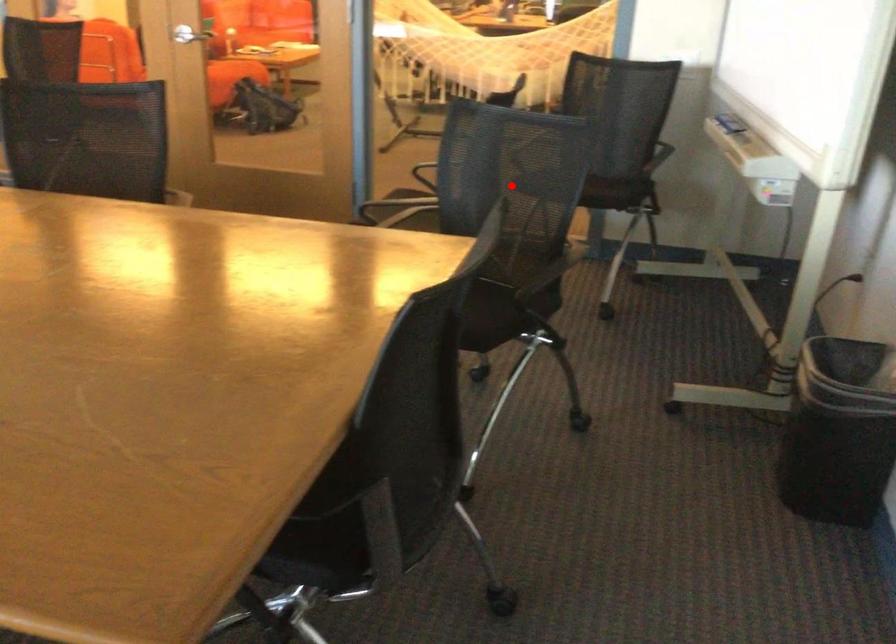
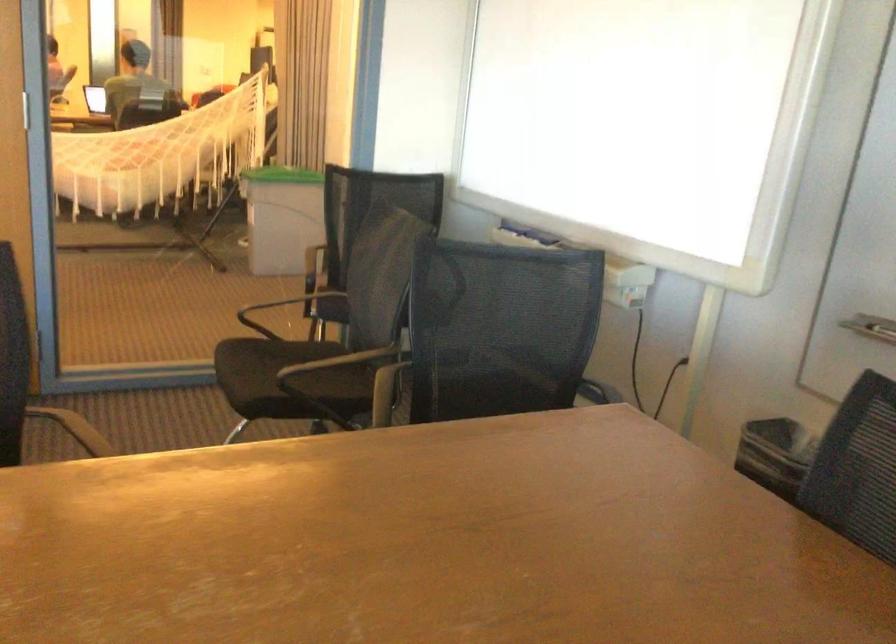
Question: I am providing you with two images of the same scene from different viewpoints. In image1, a red point is highlighted. Considering the same 3D point in image2, which of the following is correct?

Choices:
 (A) It is closer
 (B) It is farther

Answer: (A)